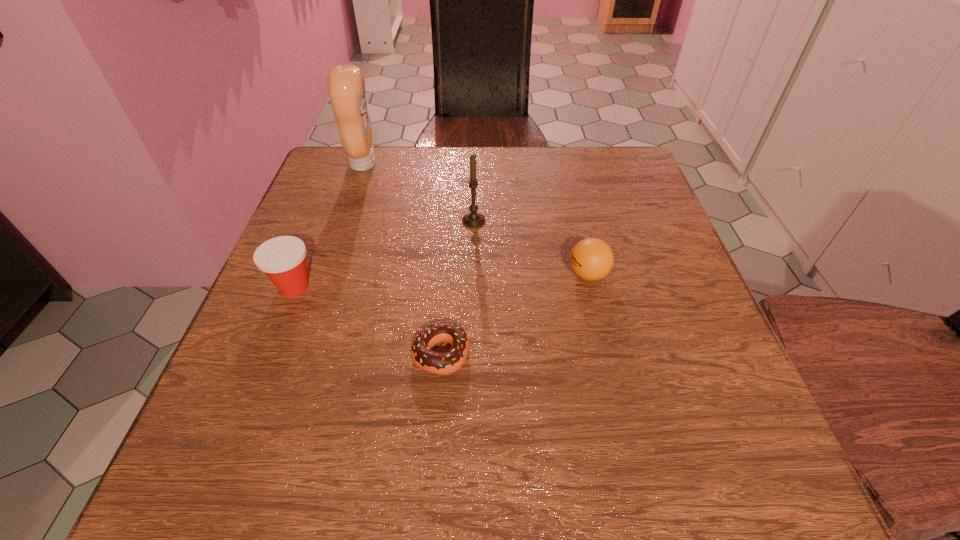
This screenshot has width=960, height=540. I want to click on vacant area between the candle and the shortest object, so click(x=457, y=287).

Where is `empty space between the ping-pong ball and the doughnut`? The image size is (960, 540). empty space between the ping-pong ball and the doughnut is located at coordinates (515, 314).

Where is `vacant area that lies between the doughnut and the candle`? The width and height of the screenshot is (960, 540). vacant area that lies between the doughnut and the candle is located at coordinates (457, 287).

At what (x,y) coordinates should I click in order to perform the action: click on free spot between the Dixie cup and the candle. Please return your answer as a coordinate pair (x, y). This screenshot has height=540, width=960. Looking at the image, I should click on (384, 253).

The width and height of the screenshot is (960, 540). I want to click on object that is the closest to the second farthest object, so click(591, 259).

This screenshot has width=960, height=540. Identify the location of the third closest object to the ping-pong ball. (282, 259).

The width and height of the screenshot is (960, 540). Identify the location of free region that satisfies the following two spatial constraints: 1. on the label of the condiment; 2. on the back side of the nearest object. (299, 354).